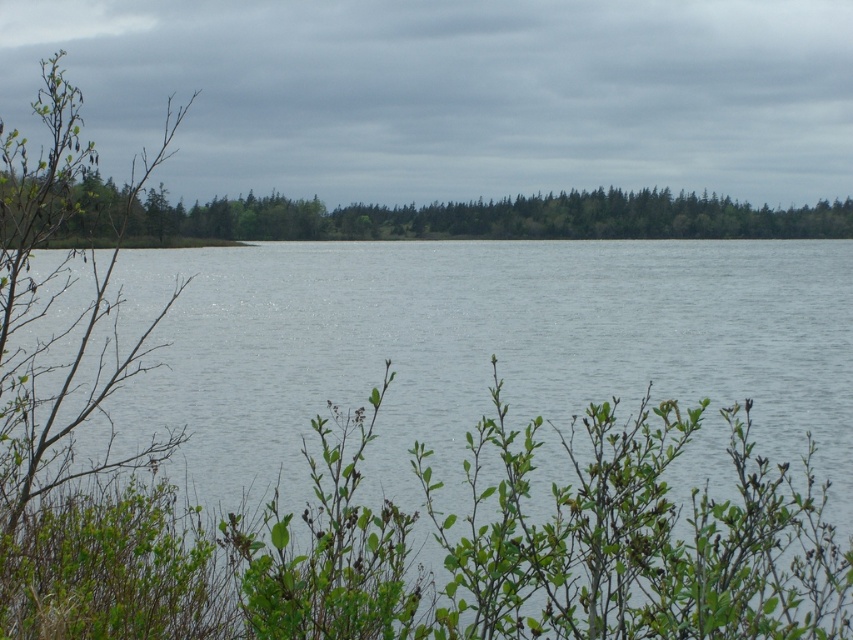
You are standing at the edge of the lake and want to cross to the other side. There are two paths available. One goes through the clear water at center and the other goes around the green leafy trees at center. Which path is wider?

The clear water at center has a lesser width compared to green leafy trees at center, so the path through the green leafy trees at center is wider and would be the better option for crossing.